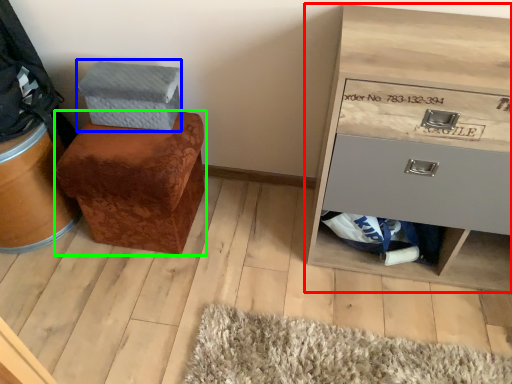
Question: Which object is the closest to the chest of drawers (highlighted by a red box)? Choose among these: shoe box (highlighted by a blue box) or furniture (highlighted by a green box).

Choices:
 (A) shoe box
 (B) furniture

Answer: (B)